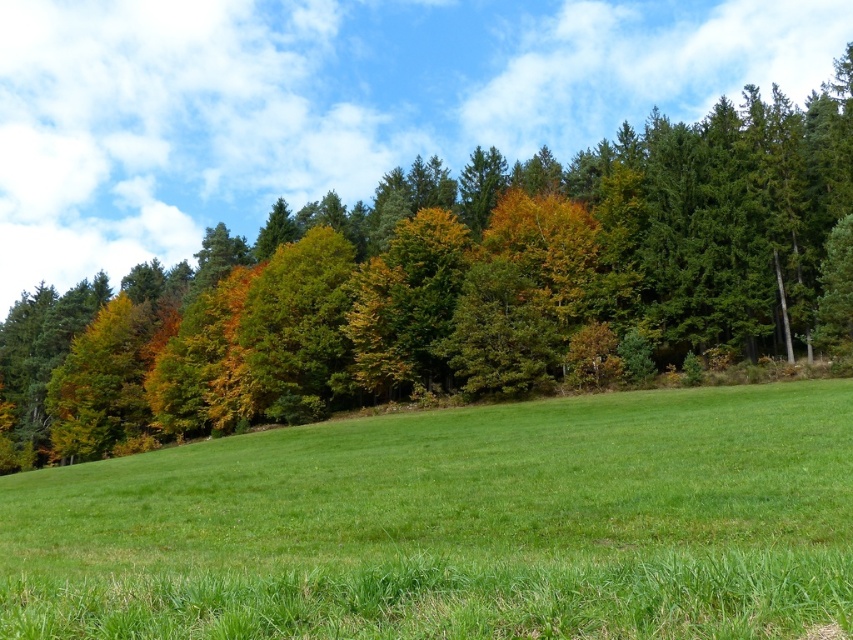
Question: Is green grass at center to the left of green leafy trees at upper center from the viewer's perspective?

Choices:
 (A) yes
 (B) no

Answer: (B)

Question: Which of the following is the closest to the observer?

Choices:
 (A) green grass at center
 (B) green leafy trees at upper center

Answer: (A)

Question: Which of the following is the farthest from the observer?

Choices:
 (A) (676, 296)
 (B) (248, 573)

Answer: (A)

Question: Does green grass at center have a greater width compared to green leafy trees at upper center?

Choices:
 (A) no
 (B) yes

Answer: (A)

Question: Which object is farther from the camera taking this photo?

Choices:
 (A) green grass at center
 (B) green leafy trees at upper center

Answer: (B)

Question: Does green grass at center appear on the right side of green leafy trees at upper center?

Choices:
 (A) yes
 (B) no

Answer: (A)